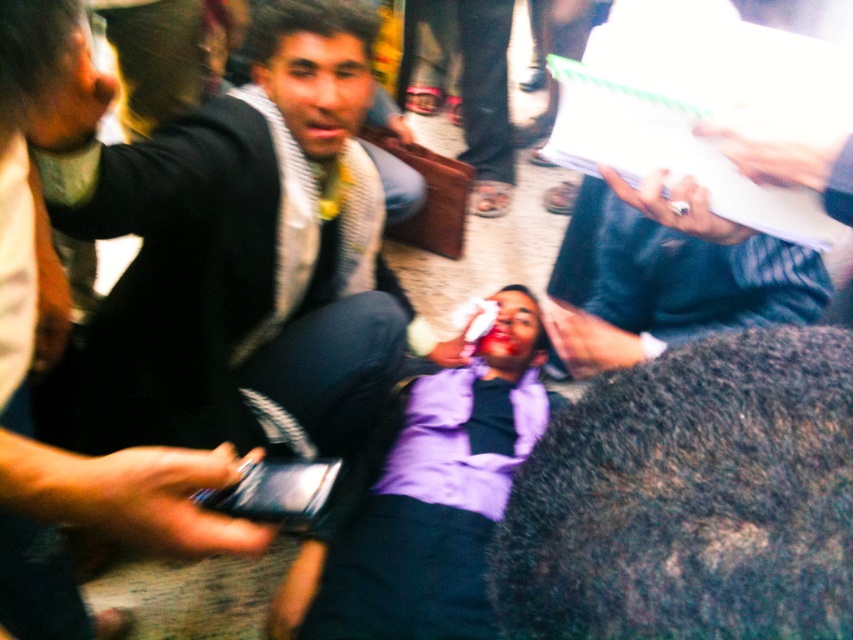
Question: Can you confirm if matte black jacket at center is wider than white paper at upper right?

Choices:
 (A) no
 (B) yes

Answer: (B)

Question: Is matte black jacket at center wider than white paper at upper right?

Choices:
 (A) yes
 (B) no

Answer: (A)

Question: Can you confirm if matte black jacket at center is smaller than white paper at upper right?

Choices:
 (A) no
 (B) yes

Answer: (A)